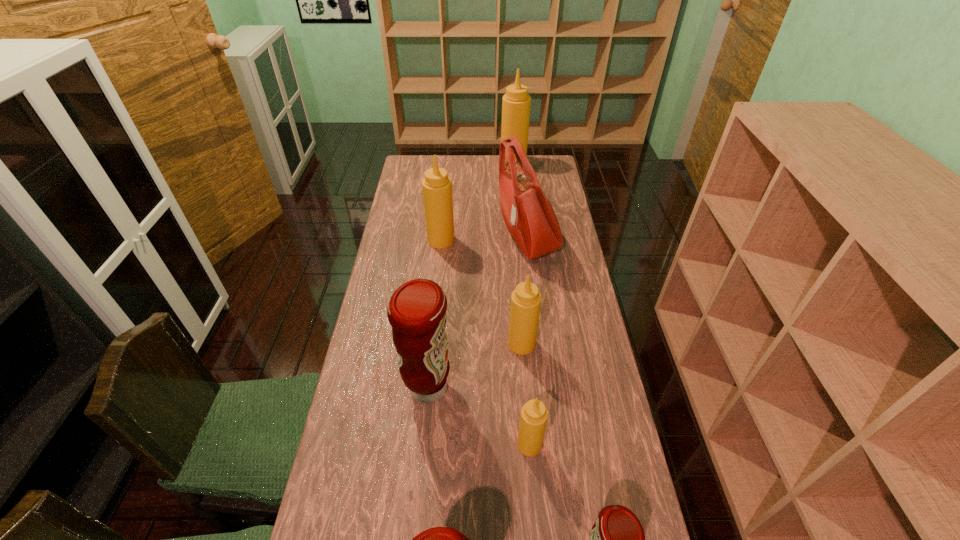
The height and width of the screenshot is (540, 960). Identify the location of object that is at the left edge. (416, 311).

I want to click on condiment at the right edge, so click(516, 103).

This screenshot has height=540, width=960. I want to click on handbag at the right edge, so click(527, 212).

In order to click on object at the far right corner in this screenshot , I will do `click(516, 103)`.

This screenshot has width=960, height=540. Identify the location of free space at the far edge. (484, 164).

Identify the location of free spot at the left edge of the desktop. (384, 334).

Identify the location of vacant space at the right edge. (545, 192).

Where is `free space at the far right corner of the desktop`? free space at the far right corner of the desktop is located at coordinates (551, 173).

Locate an element on the screen. This screenshot has width=960, height=540. free point between the smallest tan condiment and the fourth farthest condiment is located at coordinates (479, 416).

Locate an element on the screen. The height and width of the screenshot is (540, 960). vacant area that lies between the fourth nearest condiment and the fifth farthest condiment is located at coordinates (479, 416).